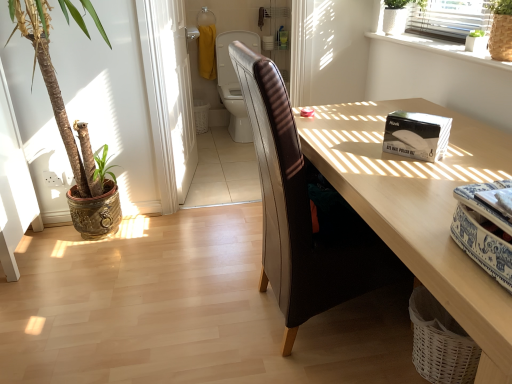
Question: From the image's perspective, is green leafy plant at upper right, positioned as the second houseplant in right-to-left order, over green woven basket at upper right, which is the fourth houseplant in left-to-right order?

Choices:
 (A) yes
 (B) no

Answer: (A)

Question: Considering the relative positions of green leafy plant at upper right, which is counted as the third houseplant, starting from the left, and green woven basket at upper right, which is the fourth houseplant in left-to-right order, in the image provided, is green leafy plant at upper right, which is counted as the third houseplant, starting from the left, to the left of green woven basket at upper right, which is the fourth houseplant in left-to-right order, from the viewer's perspective?

Choices:
 (A) yes
 (B) no

Answer: (A)

Question: From a real-world perspective, is green leafy plant at upper right, which is counted as the third houseplant, starting from the left, physically below green woven basket at upper right, the first houseplant from the right?

Choices:
 (A) yes
 (B) no

Answer: (A)

Question: From the image's perspective, is green leafy plant at upper right, positioned as the second houseplant in right-to-left order, located beneath green woven basket at upper right, the first houseplant from the right?

Choices:
 (A) no
 (B) yes

Answer: (A)

Question: Is green leafy plant at upper right, which is counted as the third houseplant, starting from the left, oriented away from green woven basket at upper right, which is the fourth houseplant in left-to-right order?

Choices:
 (A) yes
 (B) no

Answer: (B)

Question: Is green leafy plant at upper right, positioned as the second houseplant in right-to-left order, taller or shorter than white glossy screen door at upper center?

Choices:
 (A) short
 (B) tall

Answer: (A)

Question: In terms of size, does green leafy plant at upper right, positioned as the second houseplant in right-to-left order, appear bigger or smaller than white glossy screen door at upper center?

Choices:
 (A) small
 (B) big

Answer: (A)

Question: Does point (471, 38) appear closer or farther from the camera than point (159, 112)?

Choices:
 (A) closer
 (B) farther

Answer: (A)

Question: From a real-world perspective, relative to white glossy screen door at upper center, is green leafy plant at upper right, positioned as the second houseplant in right-to-left order, vertically above or below?

Choices:
 (A) below
 (B) above

Answer: (B)

Question: In terms of height, does white glossy nail polish kit at upper right look taller or shorter compared to leather-like brown swivel chair at center?

Choices:
 (A) short
 (B) tall

Answer: (A)

Question: Is white glossy nail polish kit at upper right to the left or to the right of leather-like brown swivel chair at center in the image?

Choices:
 (A) right
 (B) left

Answer: (A)

Question: Relative to leather-like brown swivel chair at center, is white glossy nail polish kit at upper right in front or behind?

Choices:
 (A) front
 (B) behind

Answer: (A)

Question: Is point (424, 142) closer or farther from the camera than point (225, 59)?

Choices:
 (A) farther
 (B) closer

Answer: (B)

Question: From a real-world perspective, is leather at center physically located above or below white wicker laundry basket at lower right?

Choices:
 (A) below
 (B) above

Answer: (B)

Question: Visually, is leather at center positioned to the left or to the right of white wicker laundry basket at lower right?

Choices:
 (A) right
 (B) left

Answer: (B)